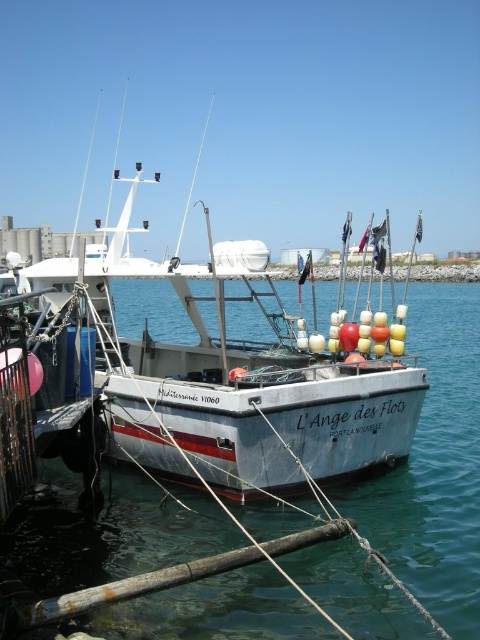
Which of these two, clear blue water at center or white matte fishing boat at center, stands taller?

white matte fishing boat at center

Is clear blue water at center taller than white matte fishing boat at center?

No.

Is point (39, 467) behind point (337, 461)?

Yes.

The image size is (480, 640). What are the coordinates of `clear blue water at center` in the screenshot? It's located at (433, 467).